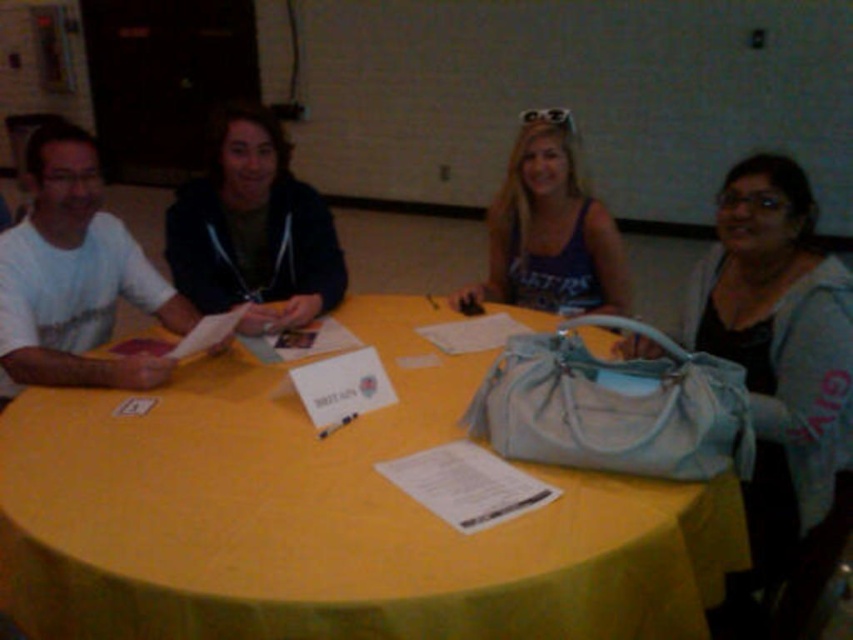
Question: Which point appears farthest from the camera in this image?

Choices:
 (A) (219, 532)
 (B) (786, 573)

Answer: (B)

Question: Which point appears closest to the camera in this image?

Choices:
 (A) (579, 246)
 (B) (27, 472)

Answer: (B)

Question: Is yellow fabric table at center above matte black hoodie at center?

Choices:
 (A) no
 (B) yes

Answer: (A)

Question: Can you confirm if yellow fabric table at center is bigger than matte blue purse at right?

Choices:
 (A) no
 (B) yes

Answer: (B)

Question: Which of these objects is positioned farthest from the matte blue purse at right?

Choices:
 (A) matte black hoodie at center
 (B) matte purple tank top at center

Answer: (A)

Question: Is yellow fabric table at center below matte black hoodie at center?

Choices:
 (A) yes
 (B) no

Answer: (A)